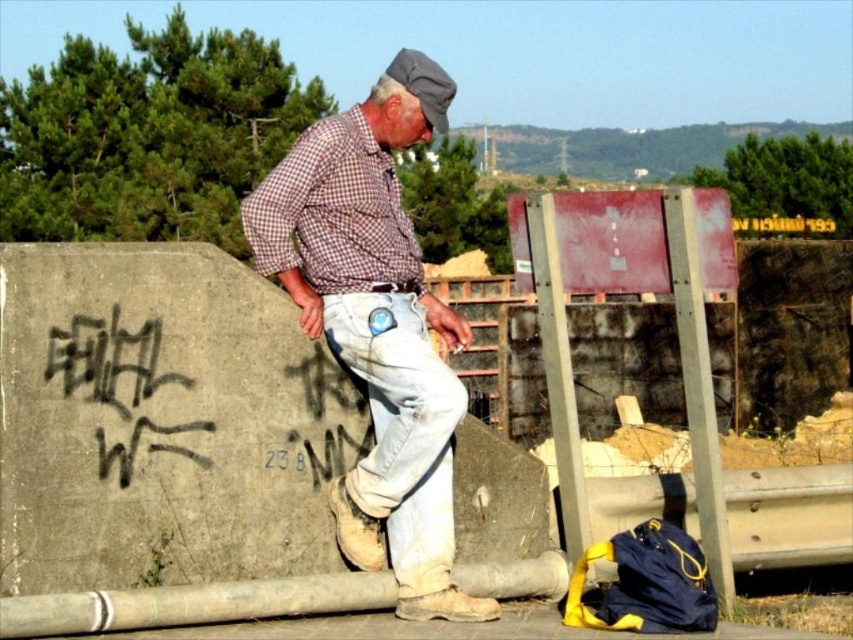
Question: Is the position of checkered fabric shirt at center more distant than that of black graffiti at left?

Choices:
 (A) yes
 (B) no

Answer: (B)

Question: Which of the following is the farthest from the observer?

Choices:
 (A) checkered fabric shirt at center
 (B) black graffiti at left

Answer: (B)

Question: Does checkered fabric shirt at center have a larger size compared to black graffiti at left?

Choices:
 (A) yes
 (B) no

Answer: (A)

Question: Is checkered fabric shirt at center above black graffiti at left?

Choices:
 (A) no
 (B) yes

Answer: (B)

Question: Which object is farther from the camera taking this photo?

Choices:
 (A) checkered fabric shirt at center
 (B) black graffiti at left

Answer: (B)